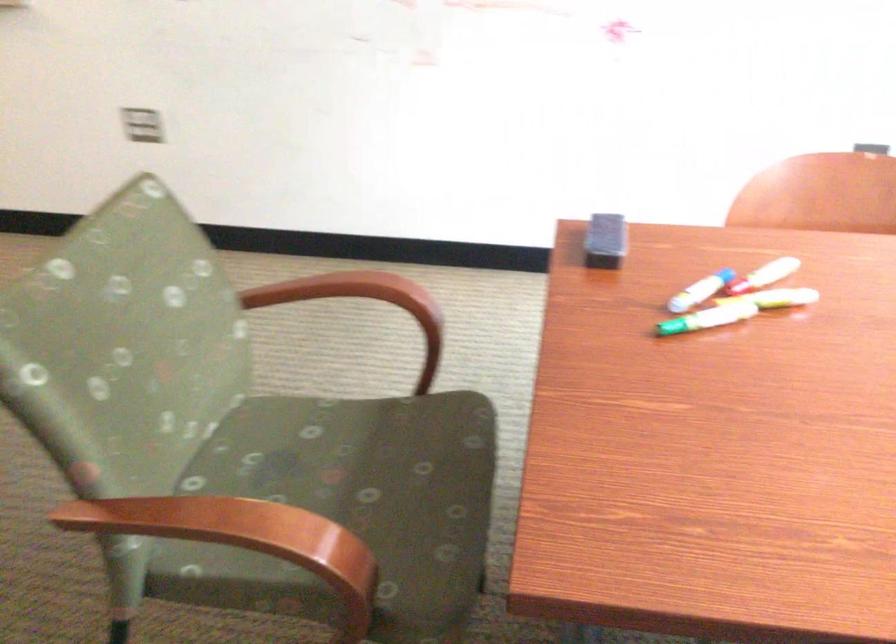
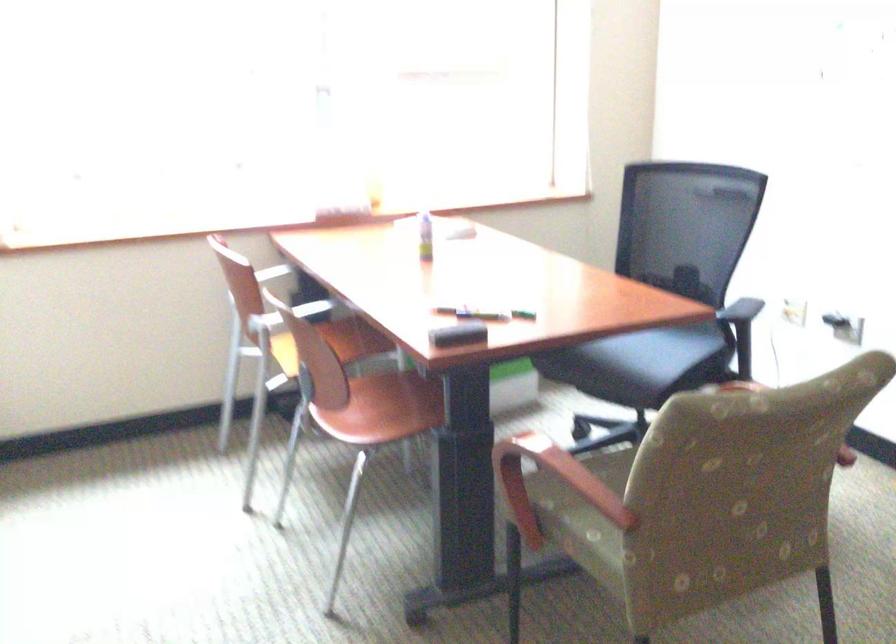
Question: I am providing you with two images of the same scene from different viewpoints. After the viewpoint changes to image2, which objects are now occluded?

Choices:
 (A) brown sofa cushion
 (B) chair sitting surface
 (C) black chair armrest
 (D) black board eraser

Answer: (B)